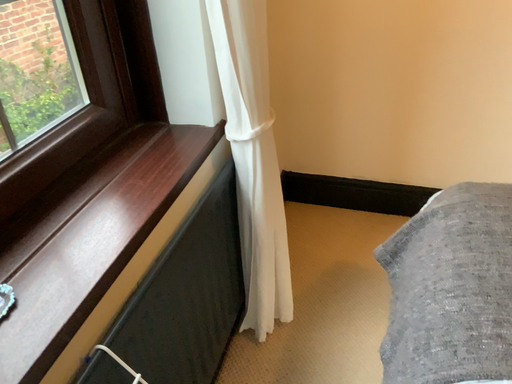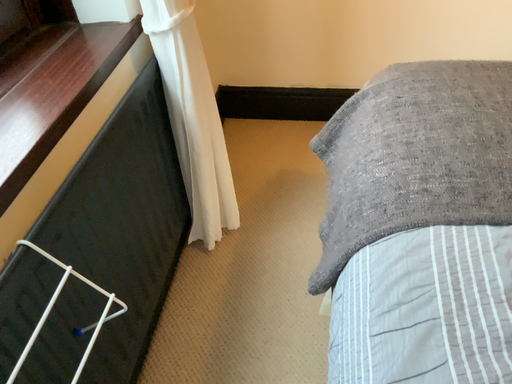
Question: How did the camera likely rotate when shooting the video?

Choices:
 (A) rotated upward
 (B) rotated downward

Answer: (B)